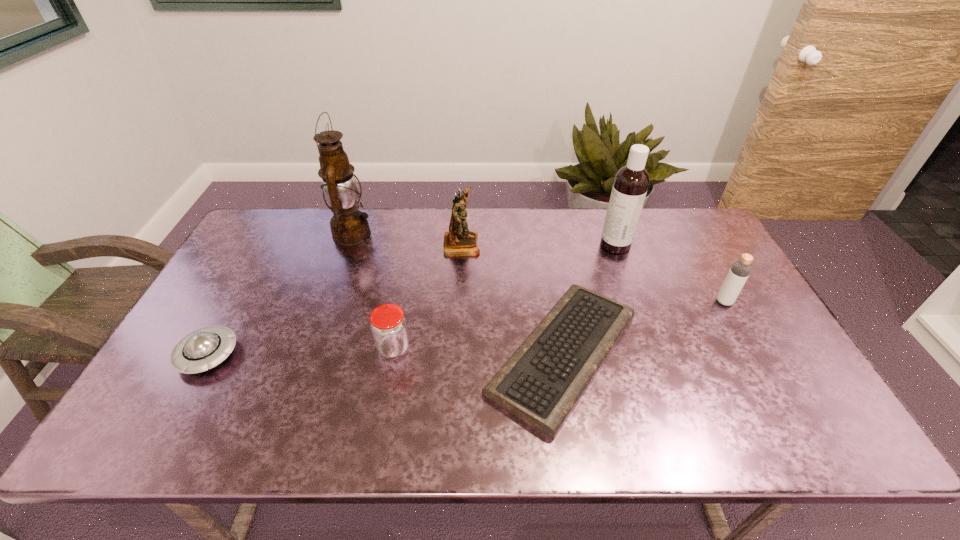
Identify the location of the tallest object. The image size is (960, 540). (349, 226).

The width and height of the screenshot is (960, 540). I want to click on oil lamp, so click(x=349, y=226).

The image size is (960, 540). I want to click on dishwasher detergent, so click(631, 182).

At what (x,y) coordinates should I click in order to perform the action: click on the fourth object from left to right. Please return your answer as a coordinate pair (x, y). Looking at the image, I should click on (458, 241).

You are a GUI agent. You are given a task and a screenshot of the screen. Output one action in this format:
    pyautogui.click(x=<x>, y=<y>)
    Task: Click on the third tallest object
    The height and width of the screenshot is (540, 960).
    Given the screenshot: What is the action you would take?
    pyautogui.click(x=458, y=241)

Where is `bottle`? The width and height of the screenshot is (960, 540). bottle is located at coordinates (740, 270).

At what (x,y) coordinates should I click in order to perform the action: click on the fourth tallest object. Please return your answer as a coordinate pair (x, y). Looking at the image, I should click on (740, 270).

Where is `the third shortest object`? the third shortest object is located at coordinates (388, 325).

Find the location of a particular element. The width and height of the screenshot is (960, 540). the third object from left to right is located at coordinates (388, 325).

At what (x,y) coordinates should I click in order to perform the action: click on the leftmost object. Please return your answer as a coordinate pair (x, y). The width and height of the screenshot is (960, 540). Looking at the image, I should click on (204, 348).